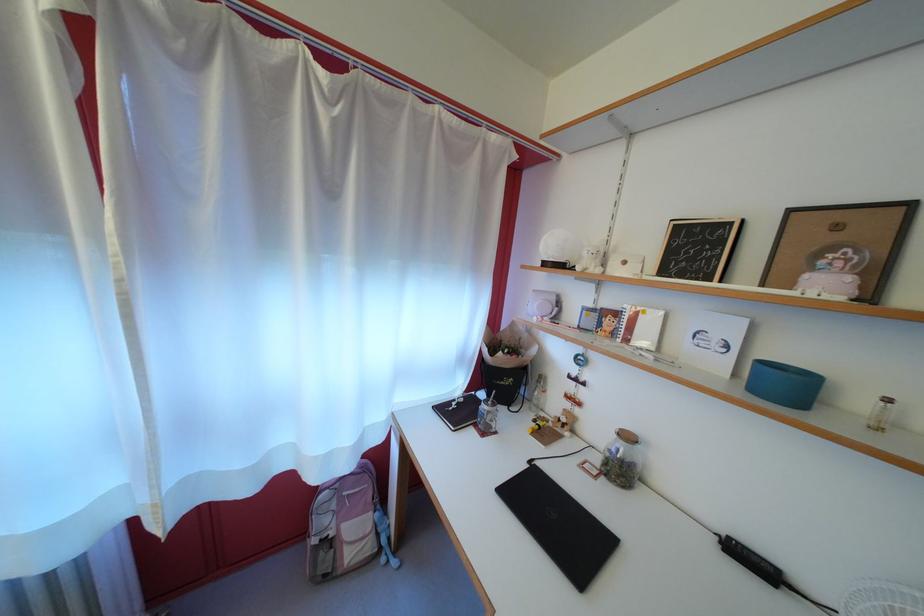
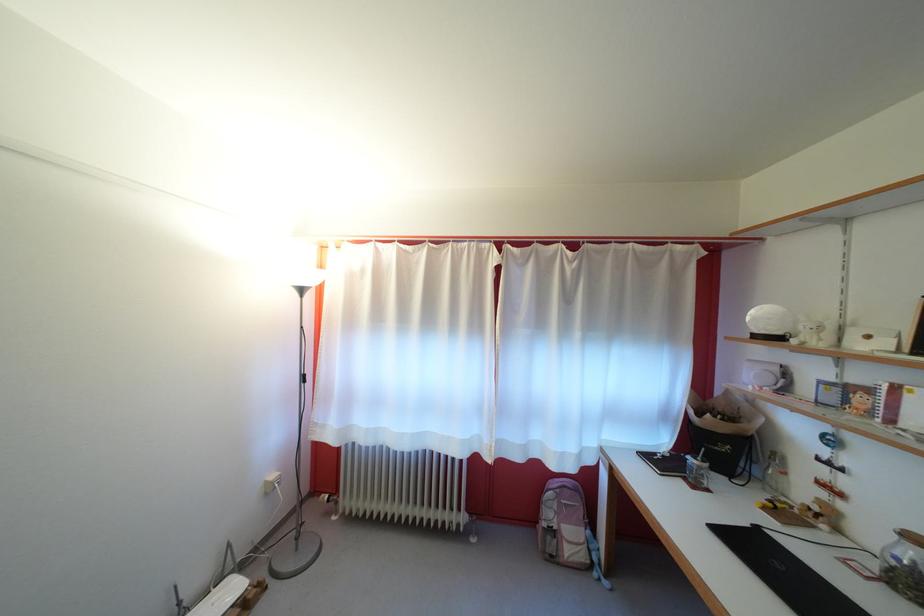
In the second image, find the point that corresponds to (331,529) in the first image.

(556, 521)